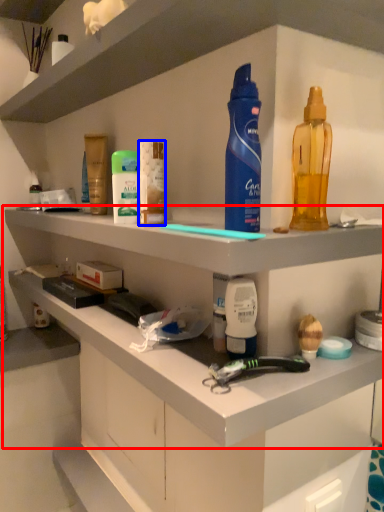
Question: Among these objects, which one is farthest to the camera, shelf (highlighted by a red box) or toiletry (highlighted by a blue box)?

Choices:
 (A) shelf
 (B) toiletry

Answer: (B)